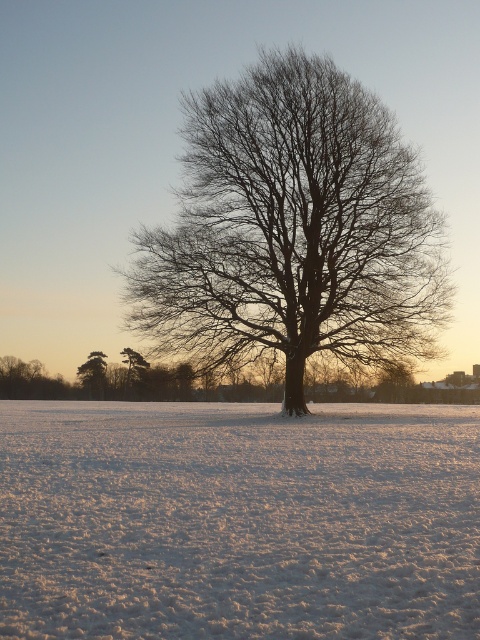
From the picture: Is the position of bare branches at center less distant than that of green matte tree at left?

Yes, bare branches at center is in front of green matte tree at left.

Consider the image. Can you confirm if bare branches at center is taller than green matte tree at left?

Yes, bare branches at center is taller than green matte tree at left.

Describe the element at coordinates (294, 228) in the screenshot. I see `bare branches at center` at that location.

You are a GUI agent. You are given a task and a screenshot of the screen. Output one action in this format:
    pyautogui.click(x=<x>, y=<y>)
    Task: Click on the bare branches at center
    
    Given the screenshot: What is the action you would take?
    pyautogui.click(x=294, y=228)

Who is positioned more to the right, green textured pine tree at lower left or green matte tree at left?

A: green matte tree at left is more to the right.

Is green textured pine tree at lower left to the left of green matte tree at left from the viewer's perspective?

Yes, green textured pine tree at lower left is to the left of green matte tree at left.

Who is more distant from viewer, (x=101, y=372) or (x=130, y=352)?

Point (x=101, y=372)

The image size is (480, 640). I want to click on green textured pine tree at lower left, so click(93, 372).

How far apart are white fluffy snow at center and green textured pine tree at lower left?

27.64 meters

Which is below, white fluffy snow at center or green textured pine tree at lower left?

green textured pine tree at lower left

The image size is (480, 640). In order to click on white fluffy snow at center in this screenshot , I will do `click(238, 520)`.

You are a GUI agent. You are given a task and a screenshot of the screen. Output one action in this format:
    pyautogui.click(x=<x>, y=<y>)
    Task: Click on the white fluffy snow at center
    The image size is (480, 640).
    Given the screenshot: What is the action you would take?
    pyautogui.click(x=238, y=520)